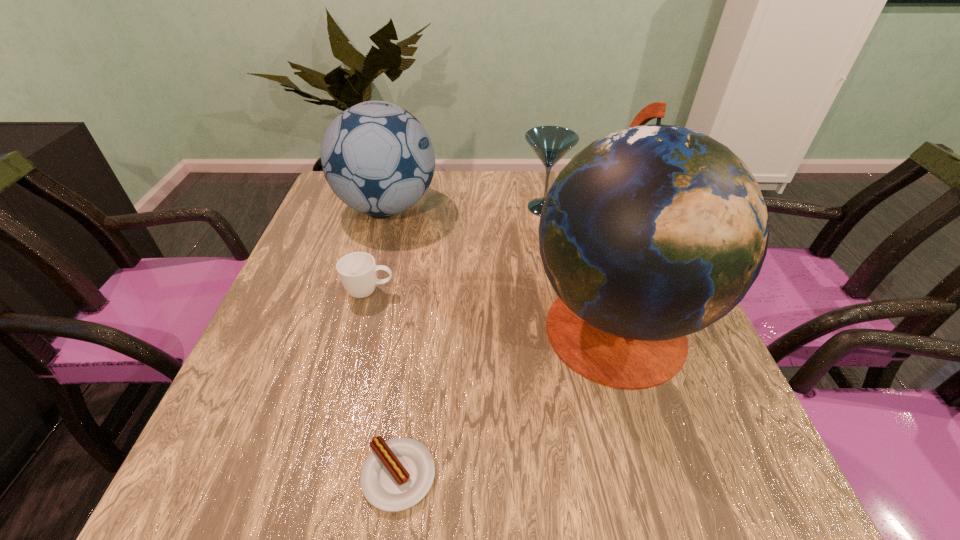
At what (x,y) coordinates should I click in order to perform the action: click on globe. Please return your answer as a coordinate pair (x, y). Looking at the image, I should click on (654, 232).

The image size is (960, 540). In order to click on the fourth shortest object in this screenshot , I will do `click(377, 158)`.

Identify the location of martini. (550, 143).

In order to click on cup in this screenshot , I will do `click(357, 271)`.

Locate an element on the screen. the nearest object is located at coordinates (398, 473).

Identify the location of sausage. The height and width of the screenshot is (540, 960). (398, 473).

Image resolution: width=960 pixels, height=540 pixels. Identify the location of free space located 0.300m with the Americas facing the viewer on the globe. (380, 326).

You are a GUI agent. You are given a task and a screenshot of the screen. Output one action in this format:
    pyautogui.click(x=<x>, y=<y>)
    Task: Click on the vacant area located with the Americas facing the viewer on the globe
    This screenshot has height=540, width=960.
    Given the screenshot: What is the action you would take?
    pyautogui.click(x=420, y=326)

Locate an element on the screen. This screenshot has height=540, width=960. free region located with the Americas facing the viewer on the globe is located at coordinates (410, 326).

Where is `free space located 0.110m on the side with brand of the fourth shortest object`? This screenshot has height=540, width=960. free space located 0.110m on the side with brand of the fourth shortest object is located at coordinates (478, 207).